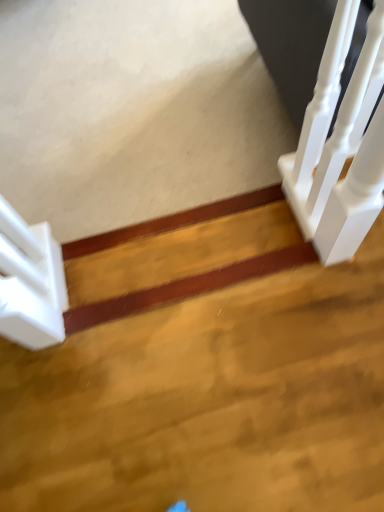
Question: From the image's perspective, is white glossy stair at left positioned above or below white glossy stairwell at upper right?

Choices:
 (A) below
 (B) above

Answer: (A)

Question: Choose the correct answer: Is white glossy stair at left inside white glossy stairwell at upper right or outside it?

Choices:
 (A) outside
 (B) inside

Answer: (A)

Question: Looking at their shapes, would you say white glossy stair at left is wider or thinner than white glossy stairwell at upper right?

Choices:
 (A) wide
 (B) thin

Answer: (A)

Question: Looking at their shapes, would you say white glossy stairwell at upper right is wider or thinner than white glossy stair at left?

Choices:
 (A) wide
 (B) thin

Answer: (B)

Question: From a real-world perspective, relative to white glossy stair at left, is white glossy stairwell at upper right vertically above or below?

Choices:
 (A) below
 (B) above

Answer: (B)

Question: From the image's perspective, is white glossy stairwell at upper right positioned above or below white glossy stair at left?

Choices:
 (A) below
 (B) above

Answer: (B)

Question: Do you think white glossy stairwell at upper right is within white glossy stair at left, or outside of it?

Choices:
 (A) inside
 (B) outside

Answer: (B)